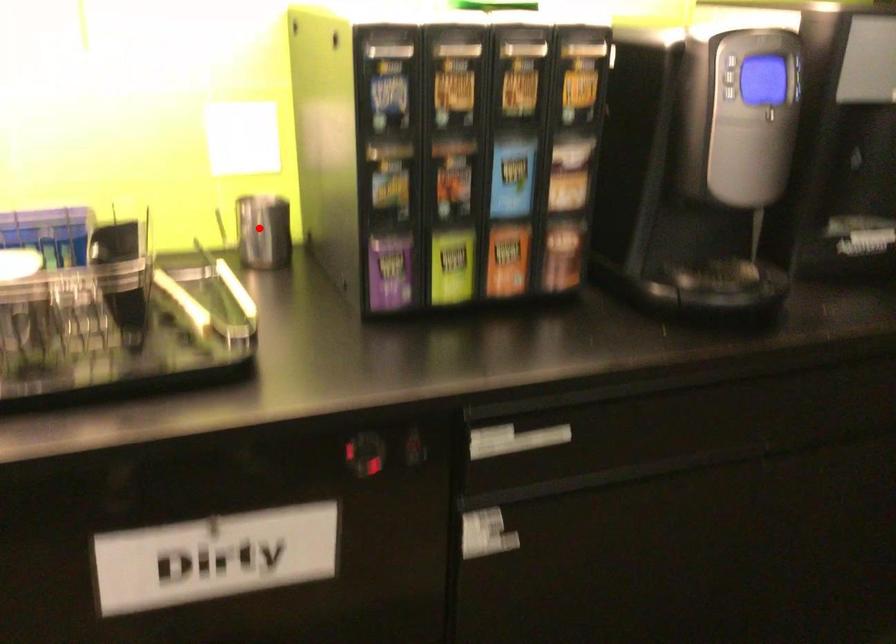
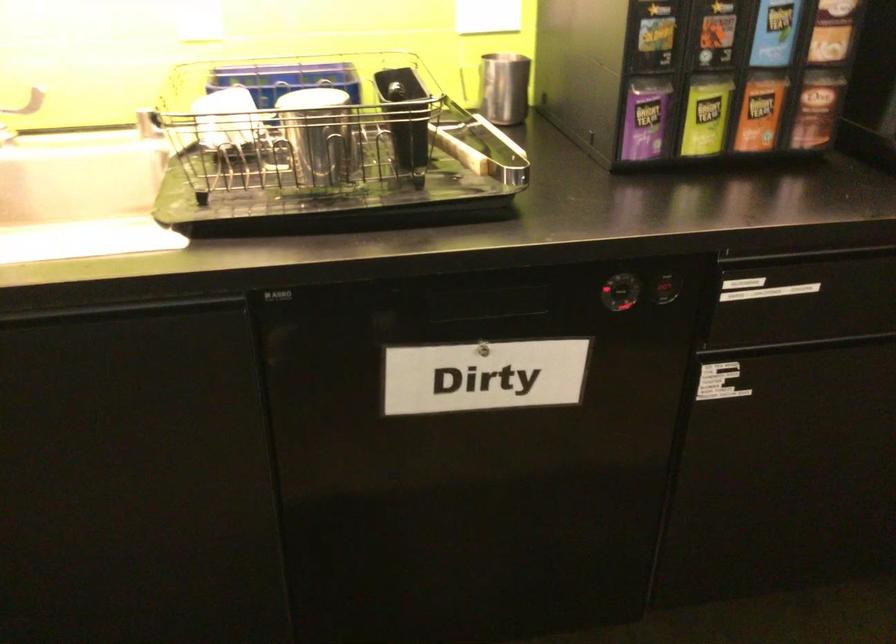
Find the pixel in the second image that matches the highlighted location in the first image.

(504, 88)